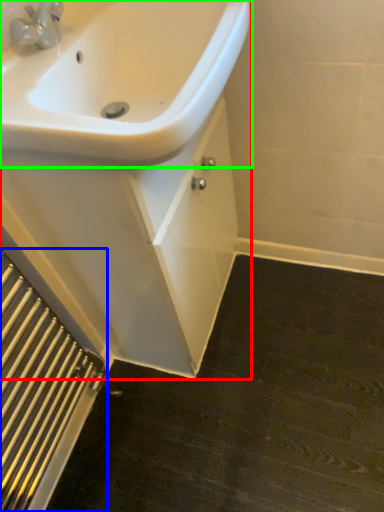
Question: Which object is the farthest from porcelain (highlighted by a red box)? Choose among these: radiator (highlighted by a blue box) or sink (highlighted by a green box).

Choices:
 (A) radiator
 (B) sink

Answer: (A)